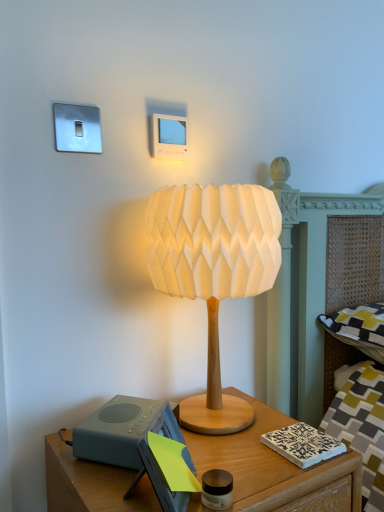
This screenshot has width=384, height=512. Find the location of `empty space that is to the right of gray matte speaker at lower left`. empty space that is to the right of gray matte speaker at lower left is located at coordinates (240, 445).